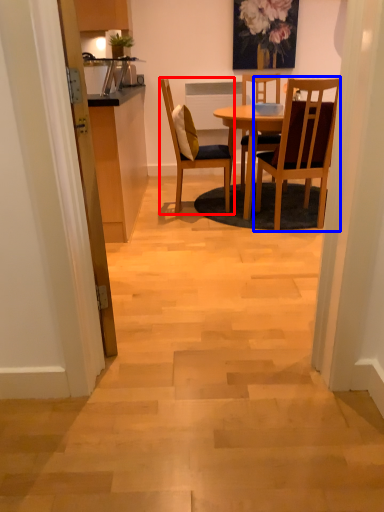
Question: Among these objects, which one is farthest to the camera, chair (highlighted by a red box) or chair (highlighted by a blue box)?

Choices:
 (A) chair
 (B) chair

Answer: (A)